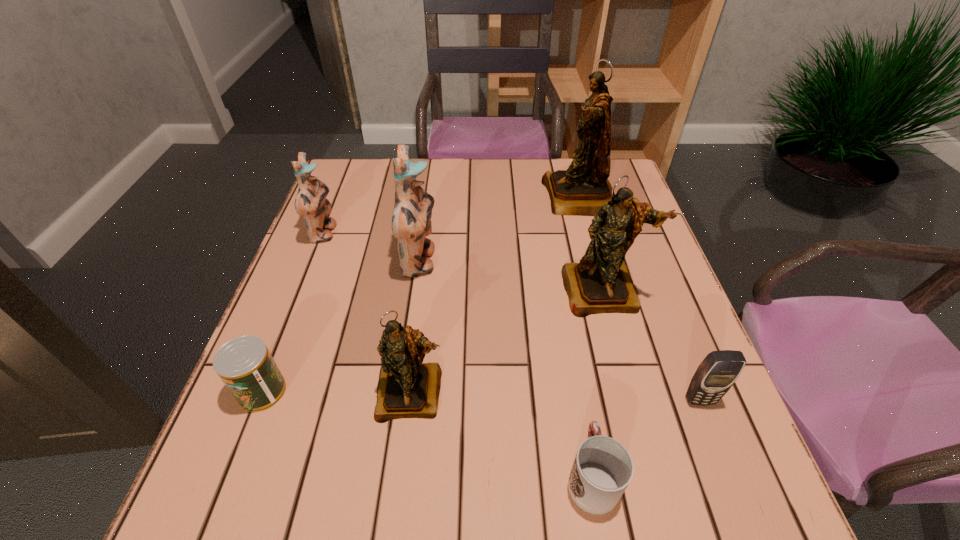
This screenshot has height=540, width=960. I want to click on free spot between the farthest gold figurine and the smallest gold figurine, so click(495, 295).

Find the location of a particular element. This screenshot has width=960, height=540. object that is the closest to the can is located at coordinates [407, 388].

Locate an element on the screen. The width and height of the screenshot is (960, 540). object that stands as the seventh closest to the right pink figurine is located at coordinates (716, 374).

The width and height of the screenshot is (960, 540). I want to click on the third closest figurine to the cup, so click(x=411, y=219).

In order to click on the second closest figurine to the tallest object in this screenshot , I will do `click(411, 219)`.

This screenshot has width=960, height=540. In order to click on gold figurine that is the third closest to the cup in this screenshot , I will do `click(581, 190)`.

The width and height of the screenshot is (960, 540). I want to click on the second closest gold figurine to the tallest object, so click(407, 388).

At what (x,y) coordinates should I click in order to perform the action: click on vacant space that satisfies the following two spatial constraints: 1. on the front-facing side of the farthest gold figurine; 2. on the front-facing side of the nearest gold figurine. Please return your answer as a coordinate pair (x, y). Looking at the image, I should click on (633, 393).

Find the location of a particular element. This screenshot has height=540, width=960. vacant region that satisfies the following two spatial constraints: 1. on the front-facing side of the bigger pink figurine; 2. on the front side of the can is located at coordinates (400, 392).

Identify the location of vacant position in the image that satisfies the following two spatial constraints: 1. on the handle side of the nearest object; 2. on the front-facing side of the bigger pink figurine. The width and height of the screenshot is (960, 540). (555, 262).